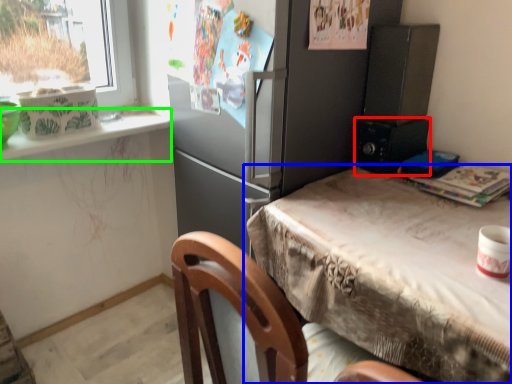
Question: Considering the real-world distances, which object is farthest from appliance (highlighted by a red box)? table (highlighted by a blue box) or window sill (highlighted by a green box)?

Choices:
 (A) table
 (B) window sill

Answer: (B)